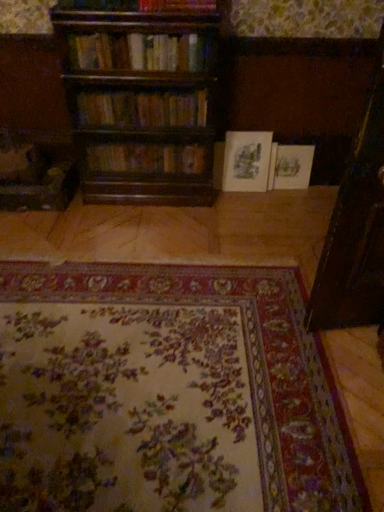
Where is `free space on the front side of white paper book at center, the 5th book in the front-to-back sequence`? The width and height of the screenshot is (384, 512). free space on the front side of white paper book at center, the 5th book in the front-to-back sequence is located at coordinates (300, 198).